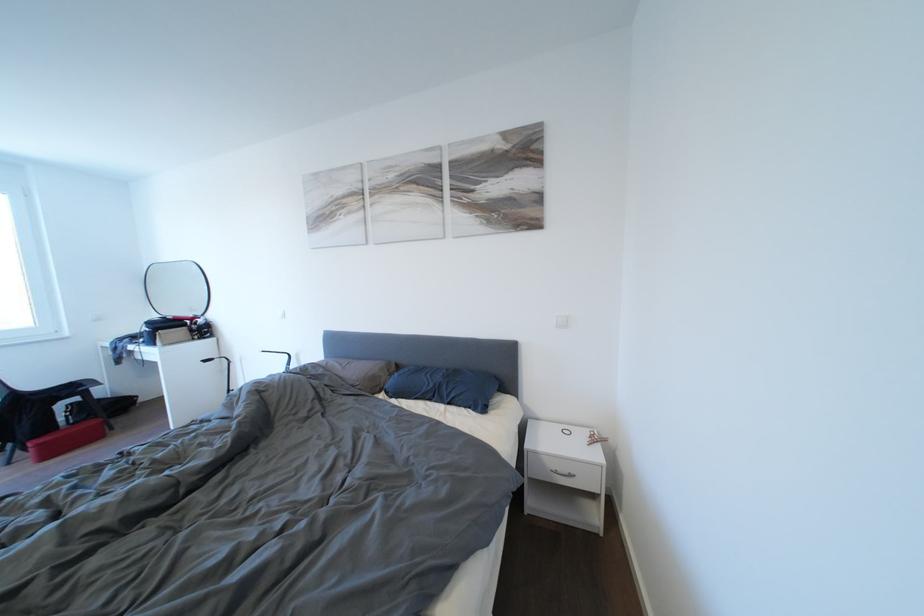
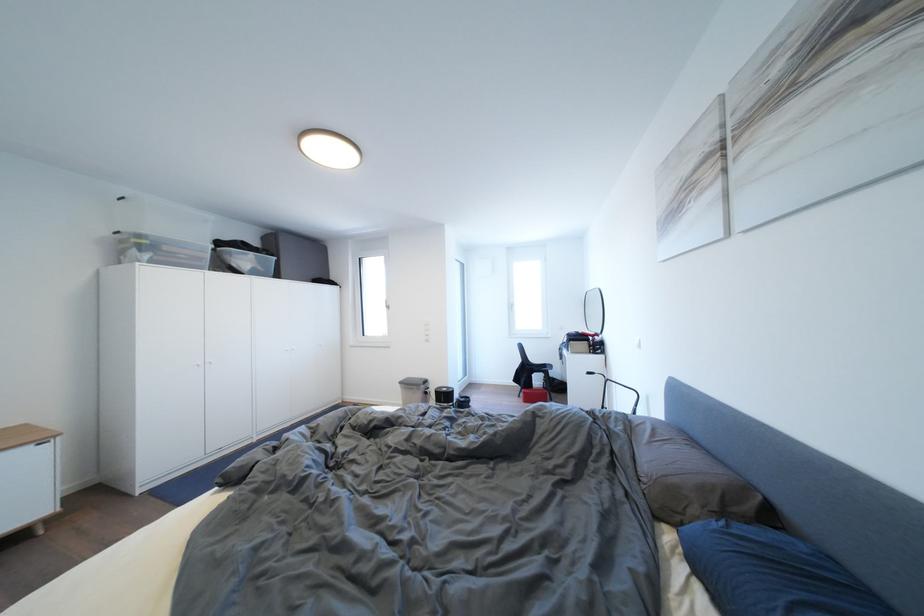
The point at (415,403) is marked in the first image. Where is the corresponding point in the second image?

(726, 607)